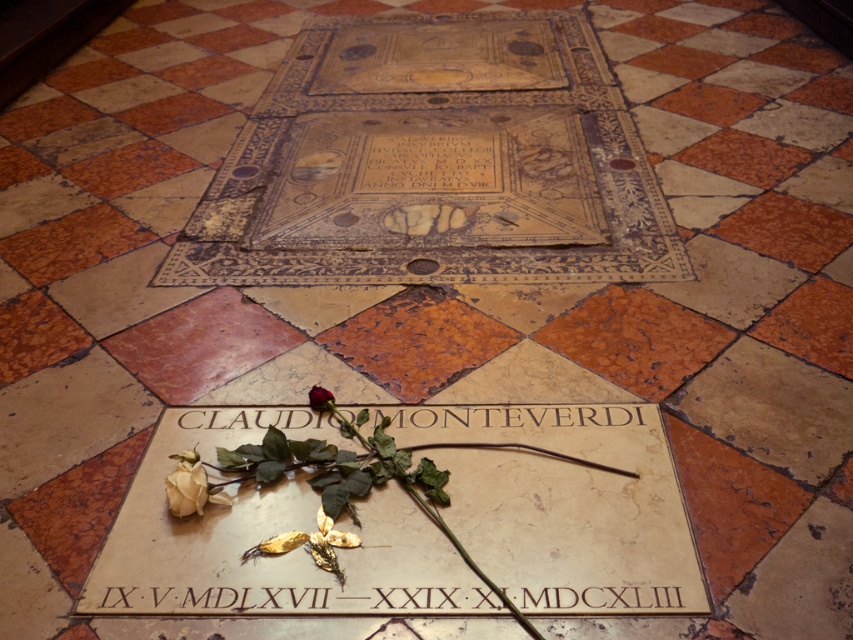
Question: Is white matte rose at lower left behind deep red rose at center?

Choices:
 (A) no
 (B) yes

Answer: (A)

Question: Considering the real-world distances, which object is farthest from the beige marble plaque at center?

Choices:
 (A) deep red rose at center
 (B) white matte rose at lower left

Answer: (A)

Question: Is the position of beige marble plaque at center more distant than that of white matte rose at lower left?

Choices:
 (A) no
 (B) yes

Answer: (A)

Question: Is the position of beige marble plaque at center less distant than that of white matte rose at lower left?

Choices:
 (A) yes
 (B) no

Answer: (A)

Question: Which point appears closest to the camera in this image?

Choices:
 (A) (321, 410)
 (B) (189, 513)
 (C) (664, 602)

Answer: (C)

Question: Which point is closer to the camera taking this photo?

Choices:
 (A) (322, 406)
 (B) (190, 456)

Answer: (B)